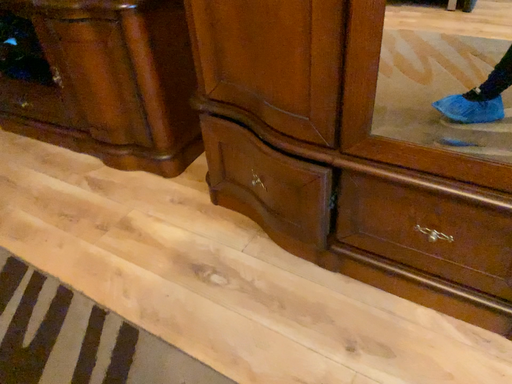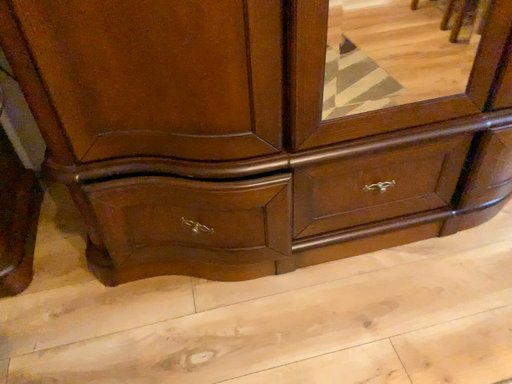
Question: How did the camera likely rotate when shooting the video?

Choices:
 (A) rotated right
 (B) rotated left

Answer: (A)